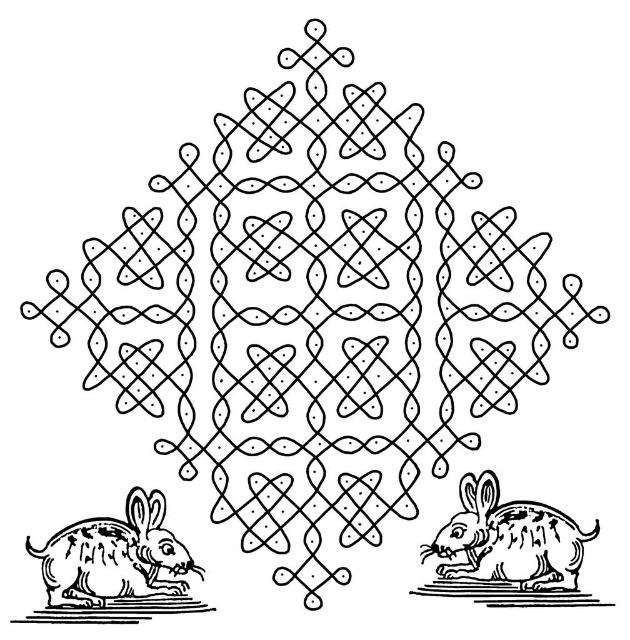
You are an artist trying to replicate the scene. You need to place the speckled fur rabbit at lower left in the correct position relative to the central Kolam design. According to the coordinates provided, where should you position the rabbit?

The speckled fur rabbit at lower left should be positioned at coordinates point (117, 557) relative to the central Kolam design as specified in the description.

You are an observer looking at the image of the Kolam design with two rabbits. Which rabbit, the speckled fur rabbit at lower left or the speckled fur rabbit at lower right, appears nearer to you?

The speckled fur rabbit at lower left is closer to the viewer than the speckled fur rabbit at lower right.